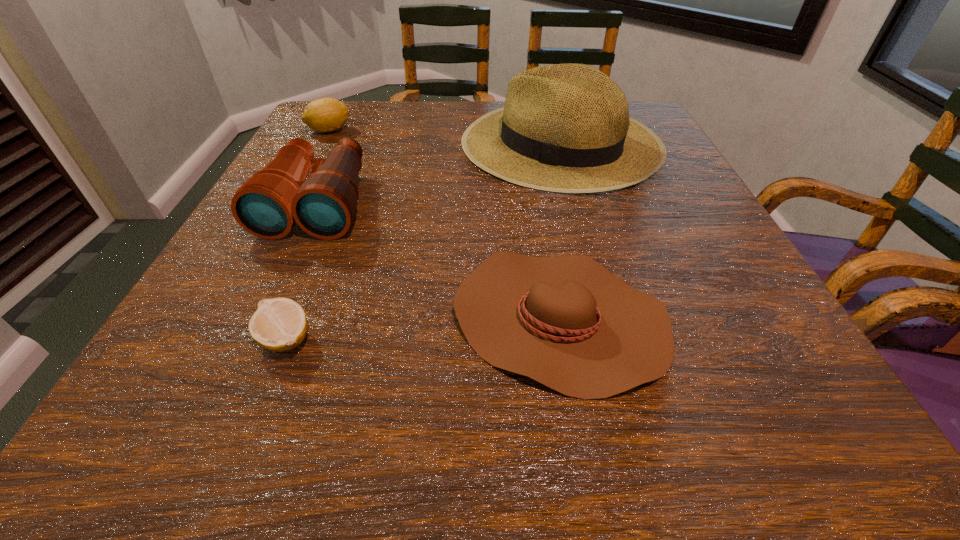
Find the location of a particular element. The height and width of the screenshot is (540, 960). sunhat is located at coordinates (566, 128).

Find the location of a particular element. The image size is (960, 540). binoculars is located at coordinates (267, 205).

You are a GUI agent. You are given a task and a screenshot of the screen. Output one action in this format:
    pyautogui.click(x=<x>, y=<y>)
    Task: Click on the farther lemon
    The height and width of the screenshot is (540, 960).
    Given the screenshot: What is the action you would take?
    pyautogui.click(x=322, y=115)

I want to click on the third shortest object, so click(x=322, y=115).

Image resolution: width=960 pixels, height=540 pixels. I want to click on the second shortest object, so click(x=567, y=322).

This screenshot has width=960, height=540. In order to click on the shortest object in this screenshot , I will do `click(279, 324)`.

The height and width of the screenshot is (540, 960). What are the coordinates of `the nearer lemon` in the screenshot? It's located at (279, 324).

Identify the location of free space located 0.190m on the front of the tallest object. Image resolution: width=960 pixels, height=540 pixels. point(592,259).

Locate an element on the screen. The width and height of the screenshot is (960, 540). blank space located through the lenses of the binoculars is located at coordinates (252, 346).

This screenshot has width=960, height=540. In order to click on vacant space located 0.300m at the stem end of the farther lemon in this screenshot , I will do click(473, 130).